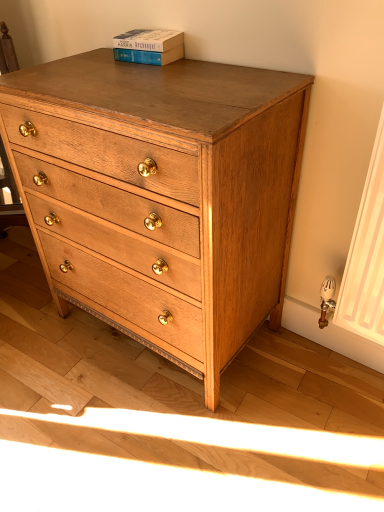
Image resolution: width=384 pixels, height=512 pixels. Identify the location of free spot to the left of natural wood chest of drawers at center. (46, 353).